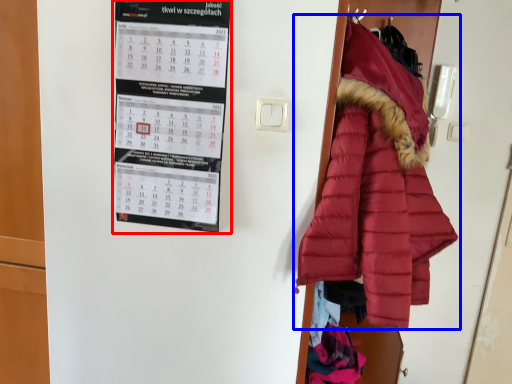
Question: Which object appears farthest to the camera in this image, bulletin board (highlighted by a red box) or coat (highlighted by a blue box)?

Choices:
 (A) bulletin board
 (B) coat

Answer: (A)